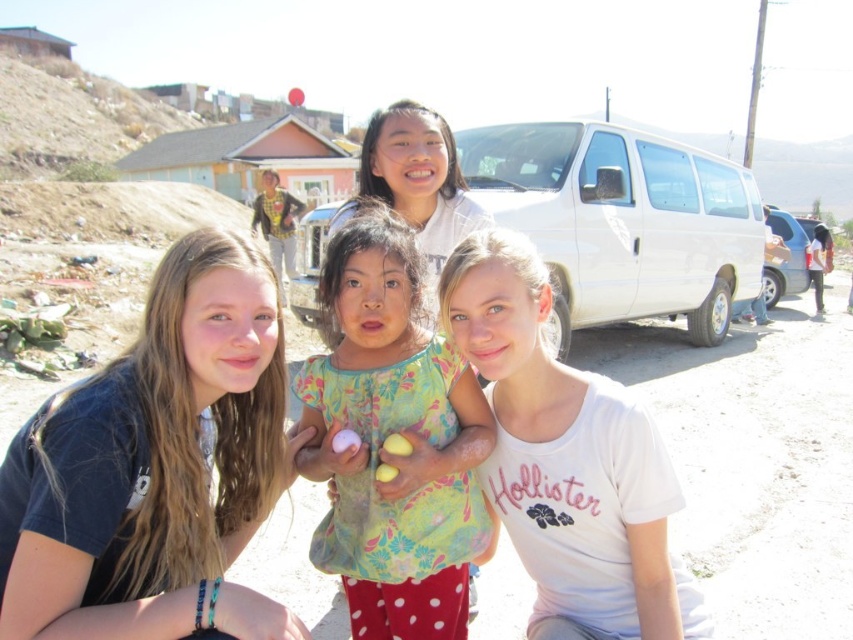
You are standing at the position of the viewer in the image. There is a floral fabric dress at center. If you want to reach the dress without moving your feet, can you do it?

The floral fabric dress at center and viewer are 2.67 meters apart from each other. Since you cannot reach 2.67 meters without moving your feet, you cannot reach the dress.

Based on the scene description, which object is positioned lower between the matte blue shirt at center and the matte white shirt at center?

The matte blue shirt at center is located below the matte white shirt at center, so it is positioned lower.

You are a photographer trying to capture a group photo of the matte blue shirt at center and the floral fabric dress at center. The camera you have can only focus on objects within a 20 inch range. Will both subjects be in focus if they stand still?

The matte blue shirt at center and floral fabric dress at center are 23.37 inches apart from each other, which exceeds the camera focus range of 20 inches. Therefore, both subjects cannot be in focus simultaneously.